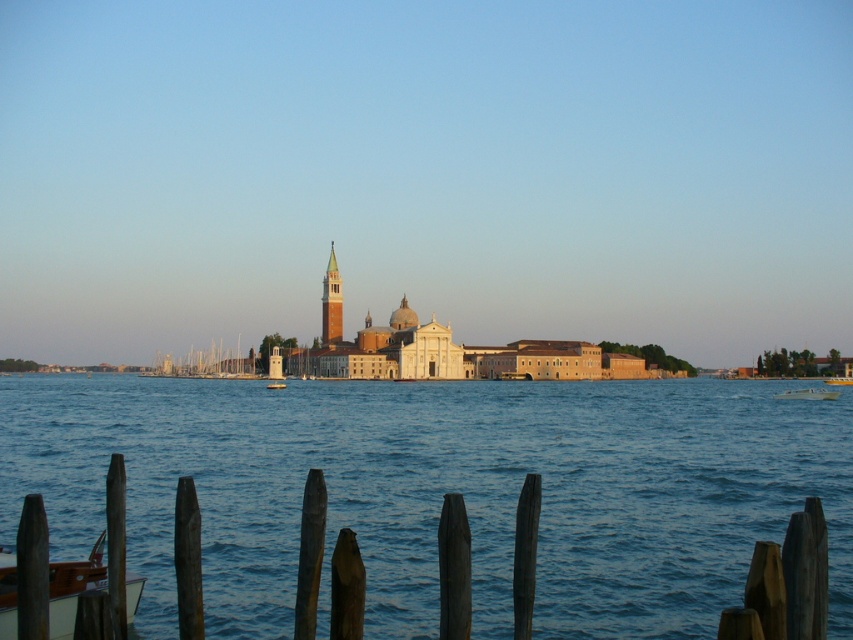
Question: Can you confirm if white glossy boat at center is wider than wooden boat at center?

Choices:
 (A) no
 (B) yes

Answer: (B)

Question: Which of the following is the closest to the observer?

Choices:
 (A) white glossy boat at center
 (B) golden brick bell tower at center
 (C) wooden boat at center
 (D) yellow plastic boat at center

Answer: (A)

Question: Which point is farther to the camera?

Choices:
 (A) (457, 582)
 (B) (332, 296)
 (C) (833, 397)

Answer: (B)

Question: Which object is the closest to the yellow plastic boat at center?

Choices:
 (A) white glossy boat at center
 (B) golden brick bell tower at center

Answer: (A)

Question: Does wooden posts at lower center appear on the left side of wooden boat at center?

Choices:
 (A) yes
 (B) no

Answer: (B)

Question: Is golden brick bell tower at center positioned in front of wooden boat at center?

Choices:
 (A) yes
 (B) no

Answer: (B)